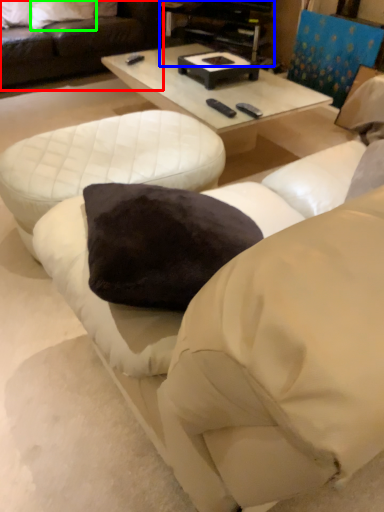
Question: Estimate the real-world distances between objects in this image. Which object is closer to studio couch (highlighted by a red box), entertainment center (highlighted by a blue box) or pillow (highlighted by a green box)?

Choices:
 (A) entertainment center
 (B) pillow

Answer: (B)